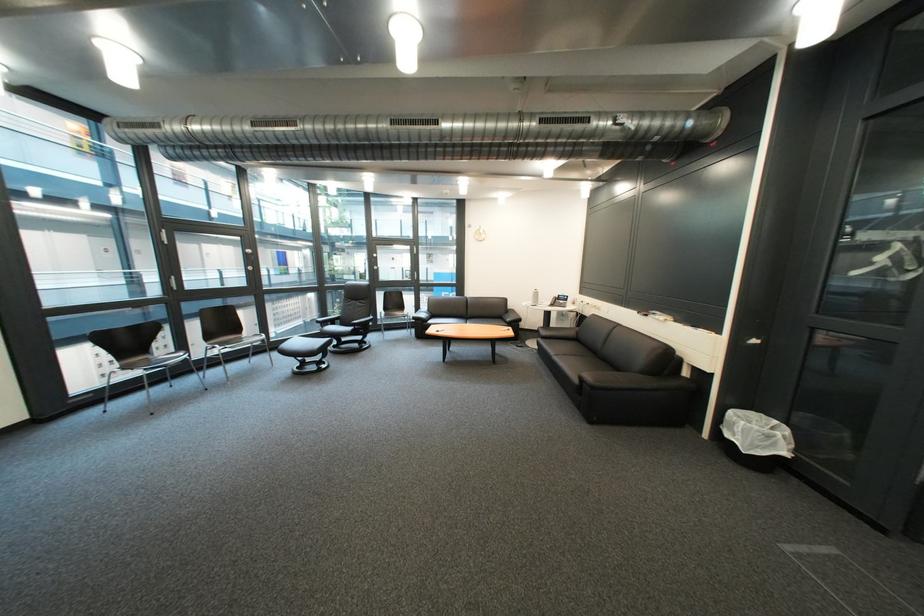
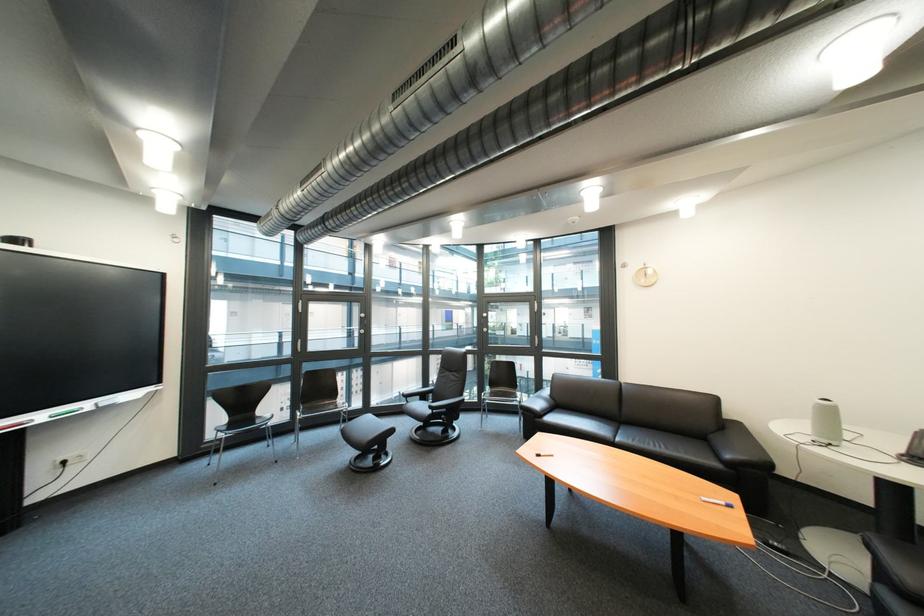
Find the pixel in the second image that matches the point at 146,275 in the first image.

(363, 331)